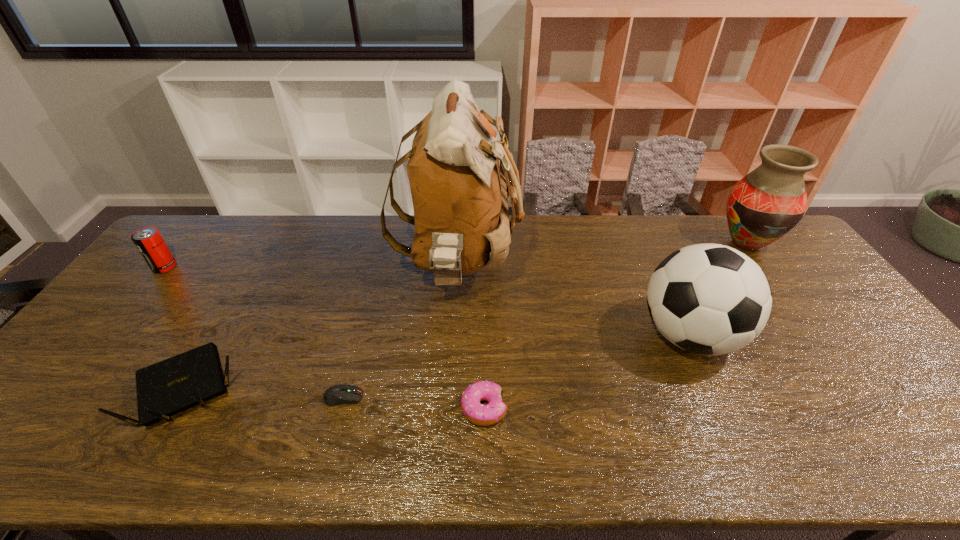
Locate an element on the screen. The height and width of the screenshot is (540, 960). computer equipment is located at coordinates (339, 394).

Where is `free region located on the front-facing side of the backpack`? Image resolution: width=960 pixels, height=540 pixels. free region located on the front-facing side of the backpack is located at coordinates (607, 266).

Find the location of `vacant region located on the front of the rightmost object`. vacant region located on the front of the rightmost object is located at coordinates (821, 347).

You are a GUI agent. You are given a task and a screenshot of the screen. Output one action in this format:
    pyautogui.click(x=<x>, y=<y>)
    Task: Click on the free space located 0.280m on the back of the soccer ball
    The height and width of the screenshot is (540, 960).
    Given the screenshot: What is the action you would take?
    pos(646,242)

In order to click on vacant point located on the front of the can in this screenshot , I will do `click(120, 321)`.

Identify the location of vacant position located on the right of the router. (347, 388).

Where is `vacant space located 0.050m on the right of the second shortest object`? The height and width of the screenshot is (540, 960). vacant space located 0.050m on the right of the second shortest object is located at coordinates (528, 408).

Where is `vacant region located on the button of the computer equipment`? This screenshot has width=960, height=540. vacant region located on the button of the computer equipment is located at coordinates (516, 397).

At what (x,y) coordinates should I click in order to perform the action: click on backpack located at the far edge. Please return your answer as a coordinate pair (x, y). This screenshot has width=960, height=540. Looking at the image, I should click on (459, 195).

This screenshot has height=540, width=960. Find the location of `vase present at the far edge`. vase present at the far edge is located at coordinates coord(763,206).